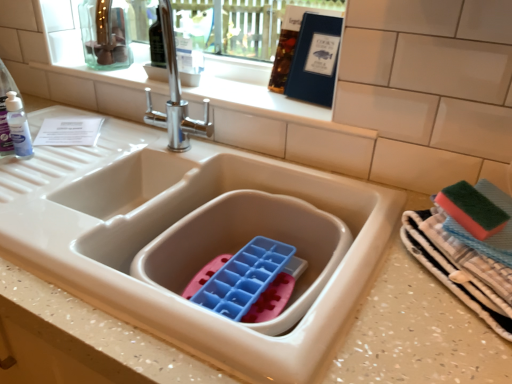
Question: In terms of width, does textured cotton towels at right look wider or thinner when compared to satin nickel faucet at upper center?

Choices:
 (A) thin
 (B) wide

Answer: (B)

Question: From a real-world perspective, is textured cotton towels at right positioned above or below satin nickel faucet at upper center?

Choices:
 (A) below
 (B) above

Answer: (A)

Question: Looking at the image, does textured cotton towels at right seem bigger or smaller compared to satin nickel faucet at upper center?

Choices:
 (A) small
 (B) big

Answer: (B)

Question: Is satin nickel faucet at upper center inside the boundaries of textured cotton towels at right, or outside?

Choices:
 (A) inside
 (B) outside

Answer: (B)

Question: Relative to textured cotton towels at right, is satin nickel faucet at upper center in front or behind?

Choices:
 (A) front
 (B) behind

Answer: (B)

Question: From the image's perspective, relative to textured cotton towels at right, is satin nickel faucet at upper center above or below?

Choices:
 (A) above
 (B) below

Answer: (A)

Question: Is point (158, 120) closer or farther from the camera than point (503, 225)?

Choices:
 (A) farther
 (B) closer

Answer: (A)